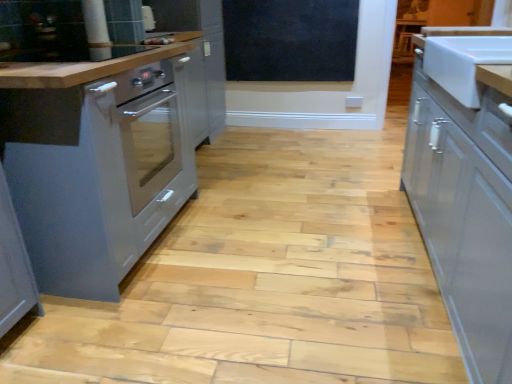
Question: Should I look upward or downward to see satin grey cabinet at left, the first cabinetry in the left-to-right sequence?

Choices:
 (A) up
 (B) down

Answer: (A)

Question: Is white glossy cabinet at right, arranged as the second cabinetry when viewed from the left, oriented towards black matte chalkboard at upper center?

Choices:
 (A) no
 (B) yes

Answer: (A)

Question: Is white glossy cabinet at right, arranged as the second cabinetry when viewed from the left, wider than black matte chalkboard at upper center?

Choices:
 (A) no
 (B) yes

Answer: (B)

Question: Can you confirm if white glossy cabinet at right, arranged as the second cabinetry when viewed from the left, is taller than black matte chalkboard at upper center?

Choices:
 (A) yes
 (B) no

Answer: (A)

Question: Does white glossy cabinet at right, placed as the 1th cabinetry when sorted from right to left, have a lesser height compared to black matte chalkboard at upper center?

Choices:
 (A) no
 (B) yes

Answer: (A)

Question: From a real-world perspective, is white glossy cabinet at right, arranged as the second cabinetry when viewed from the left, physically above black matte chalkboard at upper center?

Choices:
 (A) yes
 (B) no

Answer: (B)

Question: Does white glossy cabinet at right, placed as the 1th cabinetry when sorted from right to left, appear on the left side of black matte chalkboard at upper center?

Choices:
 (A) yes
 (B) no

Answer: (B)

Question: From the image's perspective, is white glossy sink at right beneath satin grey cabinet at left, the first cabinetry in the left-to-right sequence?

Choices:
 (A) no
 (B) yes

Answer: (A)

Question: Would you consider white glossy sink at right to be distant from satin grey cabinet at left, the first cabinetry in the left-to-right sequence?

Choices:
 (A) yes
 (B) no

Answer: (A)

Question: Does white glossy sink at right appear on the right side of satin grey cabinet at left, which is the 2th cabinetry from right to left?

Choices:
 (A) yes
 (B) no

Answer: (A)

Question: Can you confirm if white glossy sink at right is bigger than satin grey cabinet at left, which is the 2th cabinetry from right to left?

Choices:
 (A) yes
 (B) no

Answer: (B)

Question: Is satin grey cabinet at left, which is the 2th cabinetry from right to left, at the back of white glossy sink at right?

Choices:
 (A) yes
 (B) no

Answer: (B)

Question: Does white glossy sink at right come behind satin grey cabinet at left, the first cabinetry in the left-to-right sequence?

Choices:
 (A) yes
 (B) no

Answer: (B)

Question: Can you confirm if white glossy sink at right is smaller than black matte chalkboard at upper center?

Choices:
 (A) no
 (B) yes

Answer: (A)